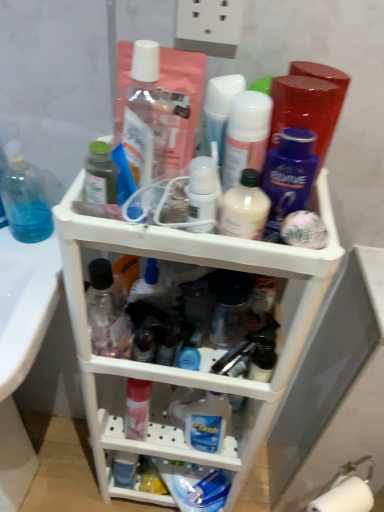
Question: Which is correct: green matte bottle at upper left, which is the second toiletry in left-to-right order, is inside transparent plastic bottle at center, which is the 8th toiletry in right-to-left order, or outside of it?

Choices:
 (A) inside
 (B) outside

Answer: (B)

Question: Considering the positions of green matte bottle at upper left, which is the second toiletry in left-to-right order, and transparent plastic bottle at center, which is the 8th toiletry in right-to-left order, in the image, is green matte bottle at upper left, which is the second toiletry in left-to-right order, bigger or smaller than transparent plastic bottle at center, which is the 8th toiletry in right-to-left order,?

Choices:
 (A) small
 (B) big

Answer: (A)

Question: Which is farther from the milky white plastic bottle at center, which ranks as the 7th toiletry in left-to-right order?

Choices:
 (A) transparent plastic bottle at center, acting as the first toiletry starting from the left
 (B) translucent plastic container at center, acting as the sixth toiletry starting from the right
 (C) matte white lotion at center, marked as the 4th toiletry in a right-to-left arrangement
 (D) transparent plastic hand soap at left
 (E) white glossy bottle at upper center, marked as the fifth toiletry in a right-to-left arrangement

Answer: (D)

Question: Which object is the closest to the matte white lotion at center, marked as the fifth toiletry in a left-to-right arrangement?

Choices:
 (A) transparent plastic bottle at center, which is the 8th toiletry in right-to-left order
 (B) white plastic shelf at center
 (C) white glossy bottle at upper center, marked as the fifth toiletry in a right-to-left arrangement
 (D) milky white plastic bottle at center, which is counted as the second toiletry, starting from the right
 (E) purple glossy deodorant at upper center, arranged as the first toiletry when viewed from the right

Answer: (C)